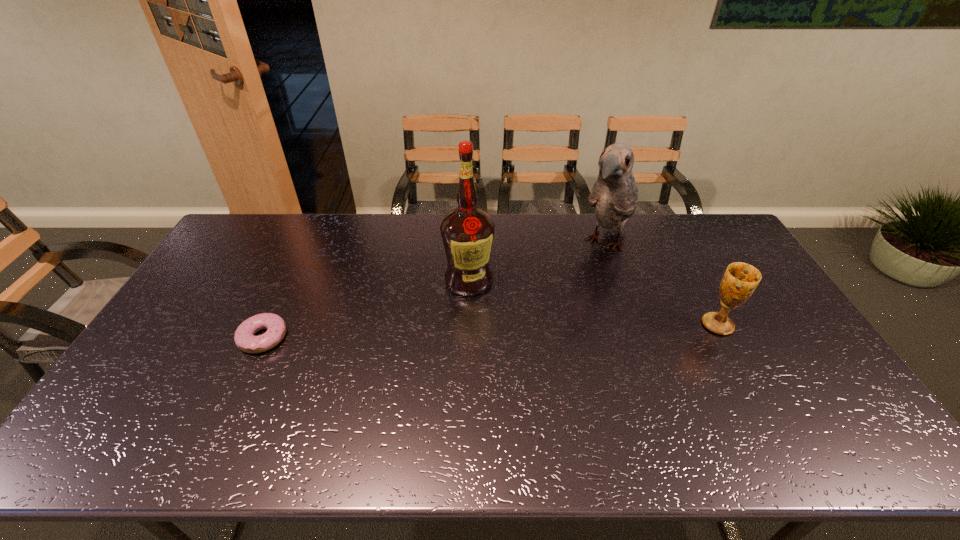
In order to click on doughnut in this screenshot , I will do `click(244, 338)`.

The image size is (960, 540). What are the coordinates of `the leftmost object` in the screenshot? It's located at (244, 338).

The height and width of the screenshot is (540, 960). Identify the location of chalice. (740, 280).

This screenshot has width=960, height=540. What are the coordinates of `the third tallest object` in the screenshot? It's located at point(740,280).

You are a GUI agent. You are given a task and a screenshot of the screen. Output one action in this format:
    pyautogui.click(x=<x>, y=<y>)
    Task: Click on the second object from left to right
    The height and width of the screenshot is (540, 960).
    Given the screenshot: What is the action you would take?
    pyautogui.click(x=467, y=232)

At what (x,y) coordinates should I click in order to perform the action: click on the third shortest object. Please return your answer as a coordinate pair (x, y). Looking at the image, I should click on (614, 196).

At what (x,y) coordinates should I click in order to perform the action: click on parrot. Please return your answer as a coordinate pair (x, y). The height and width of the screenshot is (540, 960). Looking at the image, I should click on (x=614, y=196).

Find the location of `free point located on the back of the leftmost object`. free point located on the back of the leftmost object is located at coordinates (291, 278).

Find the location of a particular element. This screenshot has width=960, height=540. free space located 0.400m on the left of the rightmost object is located at coordinates tap(567, 325).

You are a GUI agent. You are given a task and a screenshot of the screen. Output one action in this format:
    pyautogui.click(x=<x>, y=<y>)
    Task: Click on the vacant space located on the label of the alcohol
    The height and width of the screenshot is (540, 960).
    Given the screenshot: What is the action you would take?
    pyautogui.click(x=430, y=339)